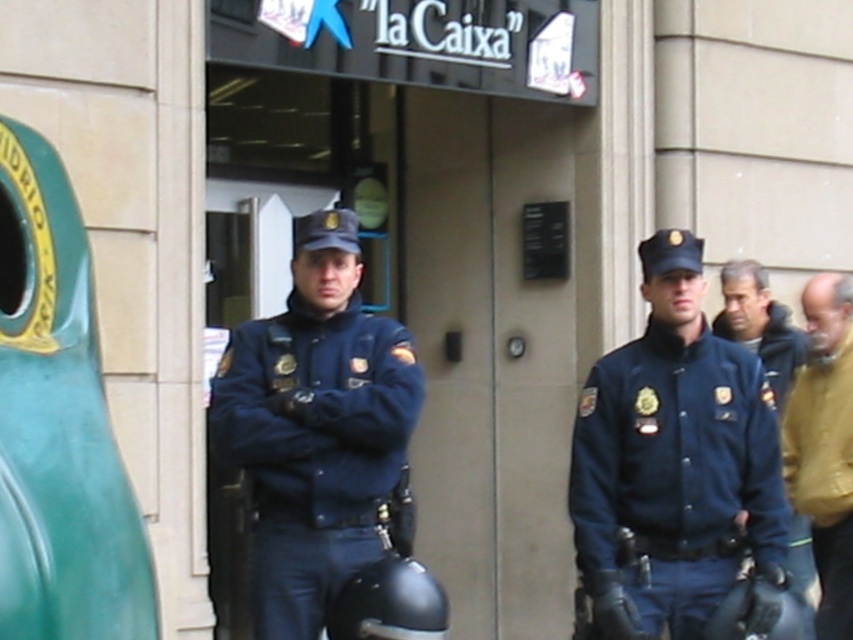
Is point (299, 348) farther from viewer compared to point (817, 426)?

That is False.

Is the position of matte blue uniform at center less distant than that of brown leather jacket at right?

Yes, matte blue uniform at center is closer to the viewer.

Is point (225, 349) farther from camera compared to point (819, 477)?

No, (225, 349) is in front of (819, 477).

Image resolution: width=853 pixels, height=640 pixels. I want to click on matte blue uniform at center, so click(312, 449).

Can you confirm if navy blue uniform at center is positioned to the left of dark blue uniform at center?

Yes, navy blue uniform at center is to the left of dark blue uniform at center.

Who is taller, navy blue uniform at center or dark blue uniform at center?

Standing taller between the two is navy blue uniform at center.

Is point (759, 506) more distant than point (772, 310)?

That is False.

Find the location of a particular element. The image size is (853, 640). navy blue uniform at center is located at coordinates (672, 481).

Between matte blue uniform at center and dark blue uniform at center, which one is positioned higher?

Positioned higher is dark blue uniform at center.

Can you confirm if matte blue uniform at center is smaller than dark blue uniform at center?

No.

Where is `matte blue uniform at center`? The image size is (853, 640). matte blue uniform at center is located at coordinates (312, 449).